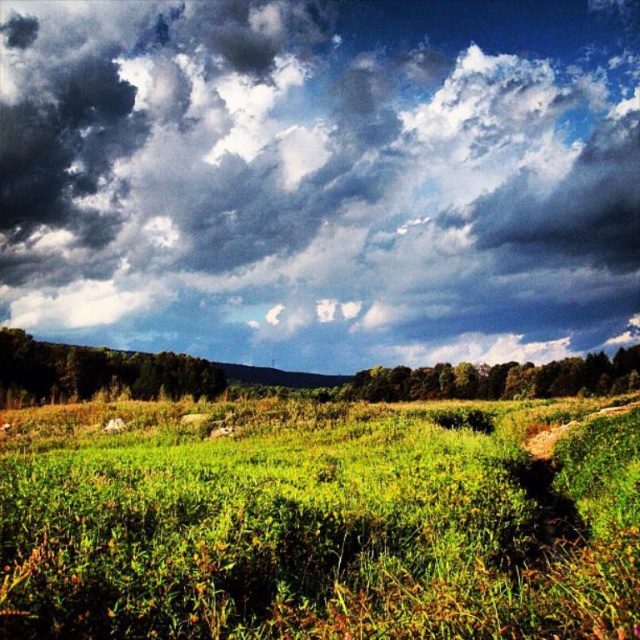
Question: Is dark fluffy cloud at upper center thinner than green grassy field at center?

Choices:
 (A) yes
 (B) no

Answer: (B)

Question: Can you confirm if dark fluffy cloud at upper center is positioned to the left of green grassy field at center?

Choices:
 (A) yes
 (B) no

Answer: (A)

Question: Which object appears closest to the camera in this image?

Choices:
 (A) dark fluffy cloud at upper center
 (B) green grassy field at center

Answer: (B)

Question: Is dark fluffy cloud at upper center bigger than green grassy field at center?

Choices:
 (A) yes
 (B) no

Answer: (A)